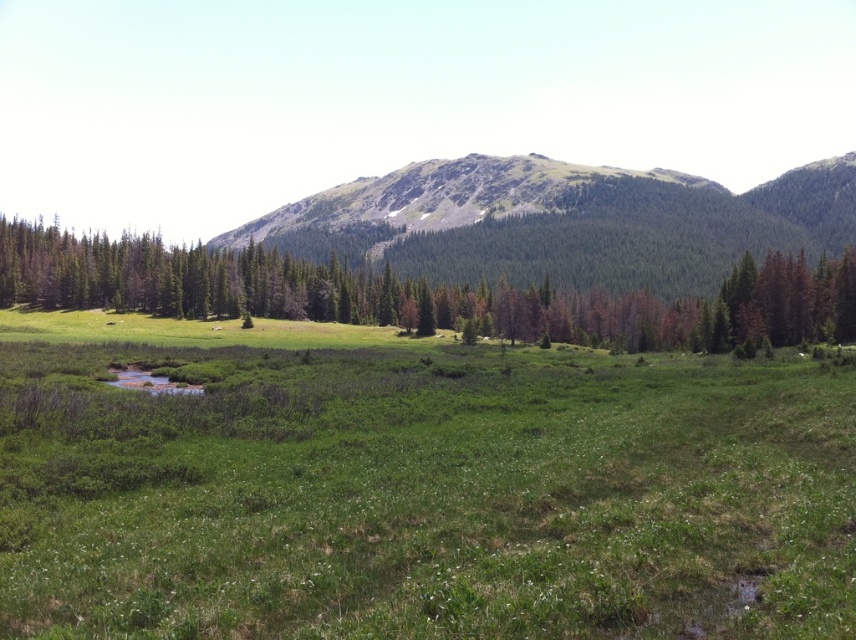
Question: Which point is closer to the camera?

Choices:
 (A) rocky mountain at center
 (B) green leafy tree at center

Answer: (B)

Question: In this image, where is rocky mountain at center located relative to green leafy tree at center?

Choices:
 (A) below
 (B) above

Answer: (B)

Question: Can you confirm if rocky mountain at center is positioned to the right of green leafy tree at center?

Choices:
 (A) no
 (B) yes

Answer: (B)

Question: Which point appears farthest from the camera in this image?

Choices:
 (A) (848, 241)
 (B) (807, 307)

Answer: (A)

Question: Can you confirm if rocky mountain at center is bigger than green leafy tree at center?

Choices:
 (A) yes
 (B) no

Answer: (A)